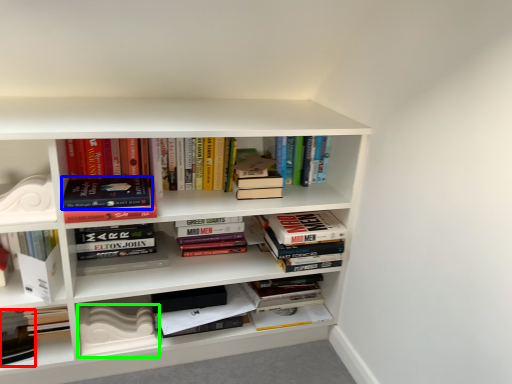
Question: Based on their relative distances, which object is nearer to book (highlighted by a red box)? Choose from book (highlighted by a blue box) and paperback book (highlighted by a green box).

Choices:
 (A) book
 (B) paperback book

Answer: (B)